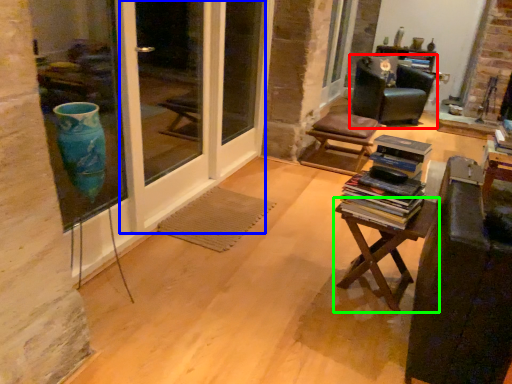
Question: Considering the real-world distances, which object is farthest from chair (highlighted by a red box)? screen door (highlighted by a blue box) or table (highlighted by a green box)?

Choices:
 (A) screen door
 (B) table

Answer: (B)